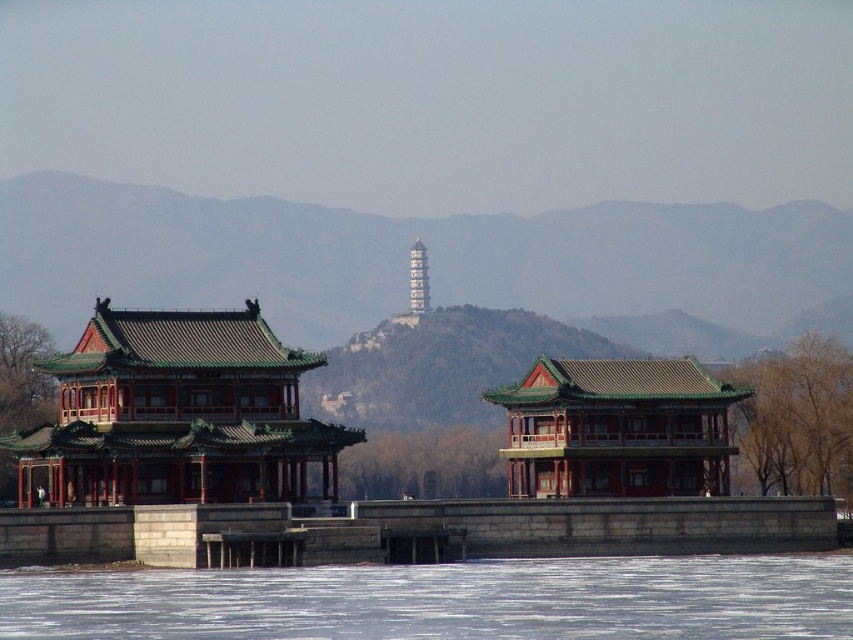
How far apart are frozen ice at lower center and gold metallic tower at center?

The distance of frozen ice at lower center from gold metallic tower at center is 91.92 meters.

Is frozen ice at lower center wider than gold metallic tower at center?

Yes.

Locate an element on the screen. frozen ice at lower center is located at coordinates (444, 600).

Does frozen ice at lower center have a greater height compared to matte red wood temple at left?

Incorrect, frozen ice at lower center's height is not larger of matte red wood temple at left's.

Does frozen ice at lower center have a smaller size compared to matte red wood temple at left?

Incorrect, frozen ice at lower center is not smaller in size than matte red wood temple at left.

The height and width of the screenshot is (640, 853). What do you see at coordinates (444, 600) in the screenshot?
I see `frozen ice at lower center` at bounding box center [444, 600].

The image size is (853, 640). Identify the location of frozen ice at lower center. (444, 600).

Is frozen ice at lower center bigger than green glazed tile temple at center?

Yes, frozen ice at lower center is bigger than green glazed tile temple at center.

Is frozen ice at lower center to the right of green glazed tile temple at center from the viewer's perspective?

No, frozen ice at lower center is not to the right of green glazed tile temple at center.

The image size is (853, 640). I want to click on frozen ice at lower center, so click(x=444, y=600).

I want to click on frozen ice at lower center, so click(x=444, y=600).